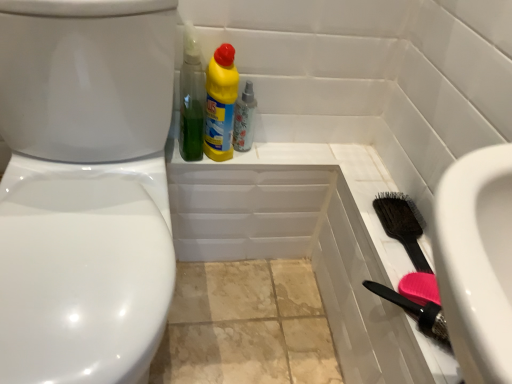
Image resolution: width=512 pixels, height=384 pixels. What are the coordinates of `vacant area that lies to the right of floral-patterned glass spray bottle at upper center` in the screenshot? It's located at (288, 145).